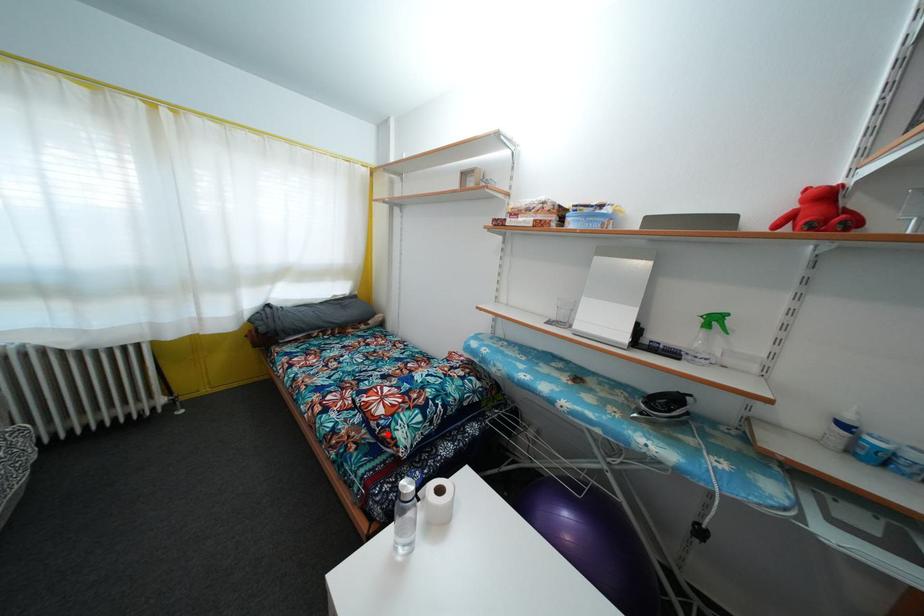
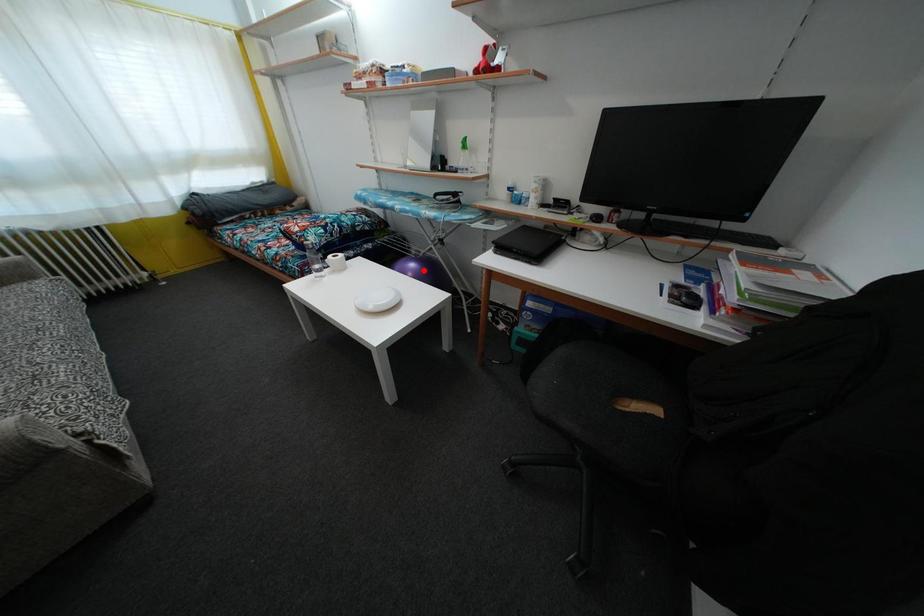
I am providing you with two images of the same scene from different viewpoints. A red point is marked on the first image and another point is marked on the second image. Do the highlighted points in image1 and image2 indicate the same real-world spot?

No